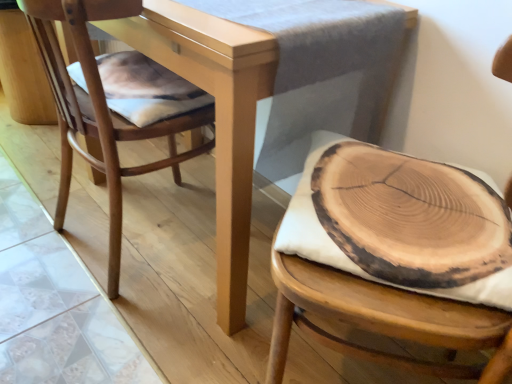
Question: Is point (509, 360) closer or farther from the camera than point (225, 322)?

Choices:
 (A) farther
 (B) closer

Answer: (B)

Question: Based on their sizes in the image, would you say wooden cushion at right, the first chair viewed from the right, is bigger or smaller than matte wood table at center?

Choices:
 (A) small
 (B) big

Answer: (A)

Question: Considering the real-world distances, which object is closest to the wooden cushion at right, which appears as the second chair when viewed from the left?

Choices:
 (A) natural wood chair at left, which is the first chair in left-to-right order
 (B) matte wood table at center
 (C) natural wood slice at center

Answer: (C)

Question: Estimate the real-world distances between objects in this image. Which object is closer to the wooden cushion at right, which appears as the second chair when viewed from the left?

Choices:
 (A) matte wood table at center
 (B) natural wood chair at left, which is the first chair in left-to-right order
 (C) natural wood slice at center

Answer: (C)